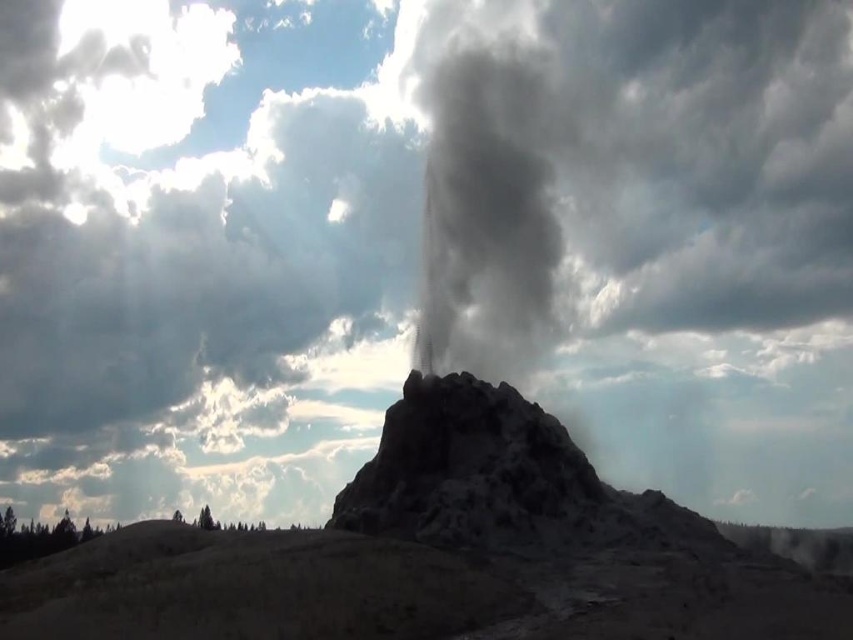
What do you see at coordinates (485, 196) in the screenshot?
I see `gray/cloudy smoke at center` at bounding box center [485, 196].

In the scene shown: Is gray/cloudy smoke at center bigger than rough stone rock formation at center?

Correct, gray/cloudy smoke at center is larger in size than rough stone rock formation at center.

Does point (549, 248) come farther from viewer compared to point (523, 481)?

Yes, point (549, 248) is farther from viewer.

The width and height of the screenshot is (853, 640). Find the location of `gray/cloudy smoke at center`. gray/cloudy smoke at center is located at coordinates (485, 196).